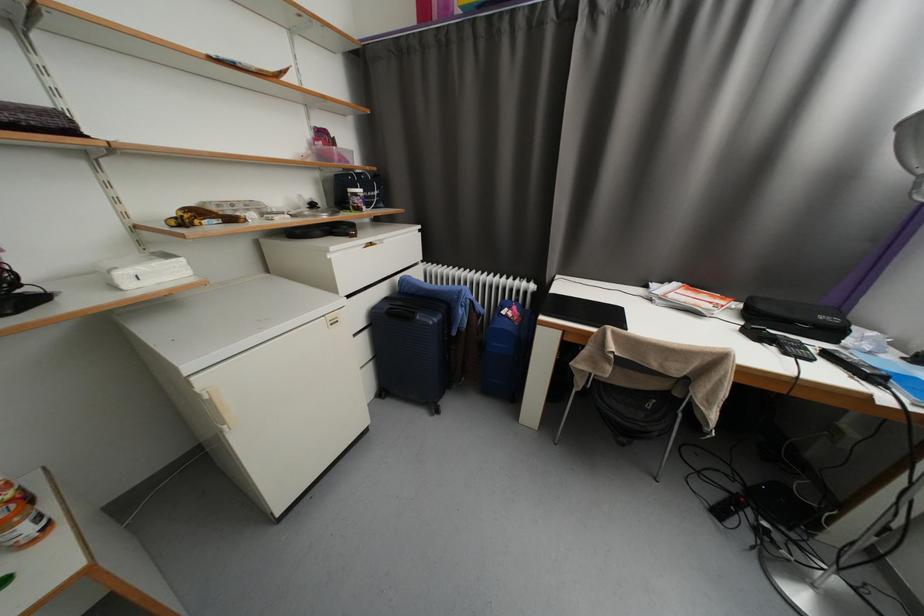
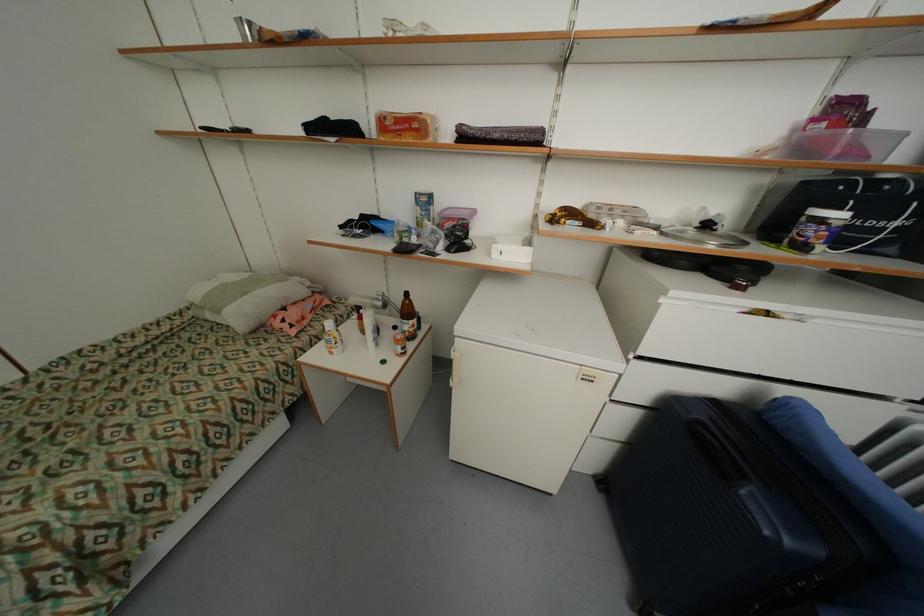
Where in the second image is the point corresponding to the point at 362,201 from the first image?

(819, 233)